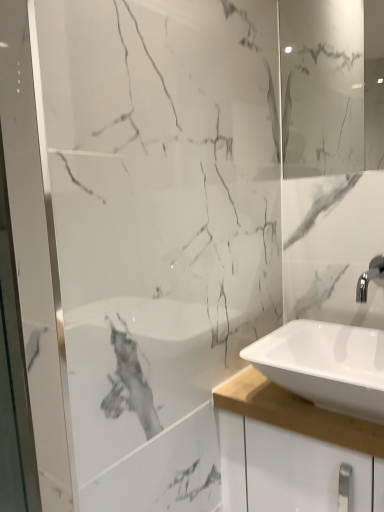
Question: Could you tell me if white glossy sink at lower right is facing white glossy mirror at upper right?

Choices:
 (A) no
 (B) yes

Answer: (A)

Question: Is white glossy sink at lower right beside white glossy mirror at upper right?

Choices:
 (A) yes
 (B) no

Answer: (B)

Question: Is white glossy sink at lower right thinner than white glossy mirror at upper right?

Choices:
 (A) yes
 (B) no

Answer: (B)

Question: From a real-world perspective, is white glossy sink at lower right over white glossy mirror at upper right?

Choices:
 (A) no
 (B) yes

Answer: (A)

Question: Can white glossy mirror at upper right be found inside white glossy sink at lower right?

Choices:
 (A) yes
 (B) no

Answer: (B)

Question: Does white glossy sink at lower right have a lesser height compared to white glossy mirror at upper right?

Choices:
 (A) no
 (B) yes

Answer: (B)

Question: Are white glossy mirror at upper right and white glossy sink at lower right located far from each other?

Choices:
 (A) no
 (B) yes

Answer: (A)

Question: Is white glossy mirror at upper right facing away from white glossy sink at lower right?

Choices:
 (A) no
 (B) yes

Answer: (A)

Question: Considering the relative sizes of white glossy mirror at upper right and white glossy sink at lower right in the image provided, is white glossy mirror at upper right taller than white glossy sink at lower right?

Choices:
 (A) yes
 (B) no

Answer: (A)

Question: Is white glossy mirror at upper right smaller than white glossy sink at lower right?

Choices:
 (A) yes
 (B) no

Answer: (A)

Question: From a real-world perspective, is white glossy mirror at upper right located beneath white glossy sink at lower right?

Choices:
 (A) no
 (B) yes

Answer: (A)

Question: Is white glossy mirror at upper right shorter than white glossy sink at lower right?

Choices:
 (A) yes
 (B) no

Answer: (B)

Question: Is white glossy mirror at upper right wider or thinner than white glossy sink at lower right?

Choices:
 (A) wide
 (B) thin

Answer: (B)